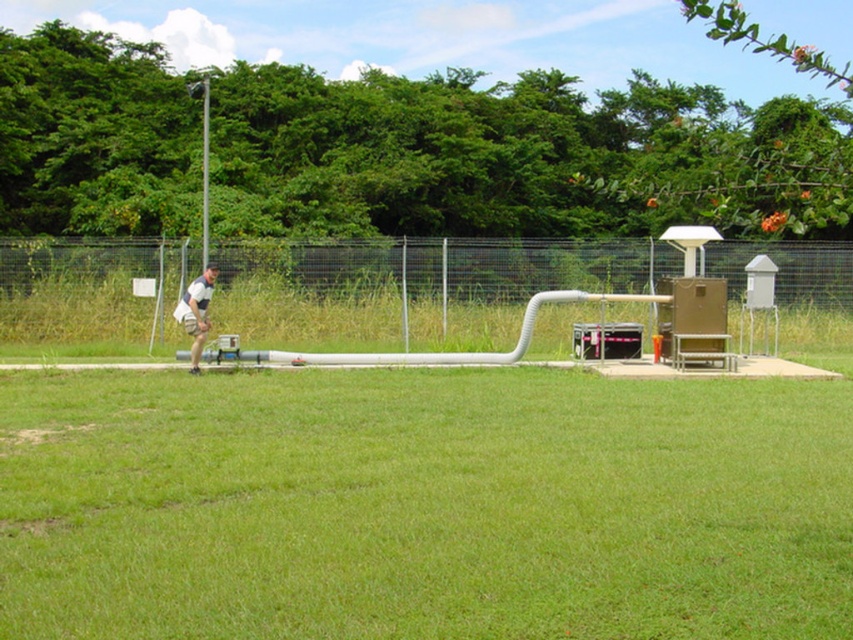
You are a maintenance worker standing on the lawn and see the metallic wire mesh fence at center and the white matte shorts at center. Which object is higher in elevation?

The metallic wire mesh fence at center is located above the white matte shorts at center, so the metallic wire mesh fence at center is higher in elevation.